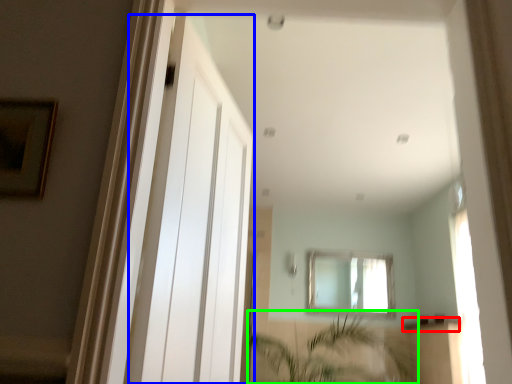
Question: Which object is positioned farthest from window sill (highlighted by a red box)? Select from screen door (highlighted by a blue box) and vegetation (highlighted by a green box).

Choices:
 (A) screen door
 (B) vegetation

Answer: (A)